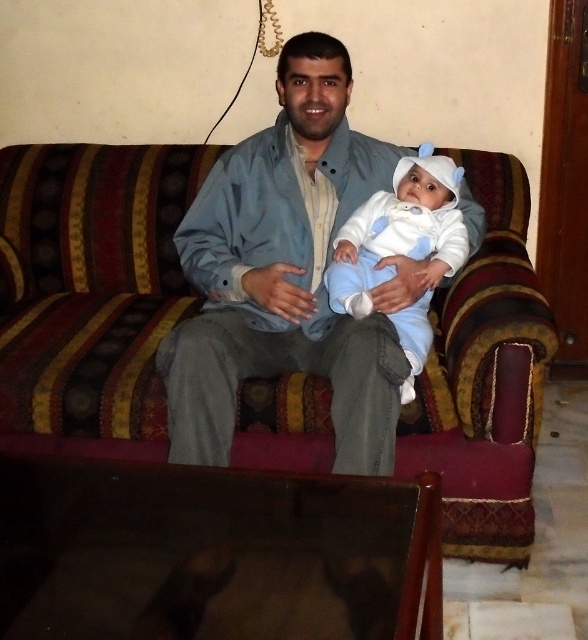
What is located at the coordinates point (91, 291) in the image?

The striped fabric couch at center is located at point (91, 291).

You are a photographer trying to capture a closeup of the white soft baby at center. You are currently standing in front of the striped fabric couch at center. Which direction should you move to get a better shot?

The striped fabric couch at center is to the left of white soft baby at center, so you should move to the right to get a better shot of the white soft baby at center.